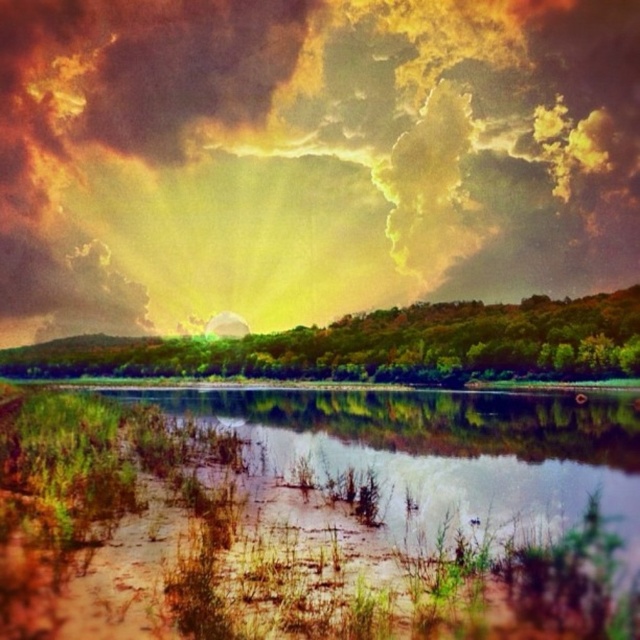
Can you confirm if golden textured clouds at upper center is positioned below brown/muddy water at lower center?

Incorrect, golden textured clouds at upper center is not positioned below brown/muddy water at lower center.

Between golden textured clouds at upper center and brown/muddy water at lower center, which one is positioned lower?

brown/muddy water at lower center is lower down.

Is point (346, 161) less distant than point (588, 436)?

No, it is behind (588, 436).

At what (x,y) coordinates should I click in order to perform the action: click on golden textured clouds at upper center. Please return your answer as a coordinate pair (x, y). This screenshot has width=640, height=640. Looking at the image, I should click on (308, 156).